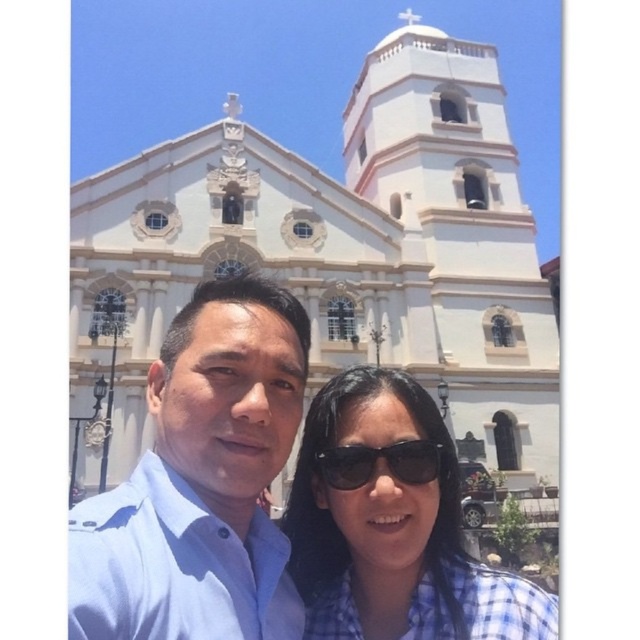
Is white stone church at center thinner than blue shirt at center?

Incorrect, white stone church at center's width is not less than blue shirt at center's.

Can you confirm if white stone church at center is shorter than blue shirt at center?

No.

The image size is (640, 640). In order to click on white stone church at center in this screenshot , I will do `click(342, 253)`.

Identify the location of white stone church at center. (342, 253).

Image resolution: width=640 pixels, height=640 pixels. What do you see at coordinates (200, 483) in the screenshot? I see `blue shirt at center` at bounding box center [200, 483].

Does blue shirt at center have a larger size compared to blue checkered shirt at center?

Yes.

Which is in front, point (250, 285) or point (422, 486)?

Positioned in front is point (422, 486).

What are the coordinates of `blue shirt at center` in the screenshot? It's located at (200, 483).

Who is higher up, blue shirt at center or black matte sunglasses at center?

blue shirt at center is higher up.

Does blue shirt at center have a smaller size compared to black matte sunglasses at center?

No.

What do you see at coordinates (200, 483) in the screenshot?
I see `blue shirt at center` at bounding box center [200, 483].

At what (x,y) coordinates should I click in order to perform the action: click on blue shirt at center. Please return your answer as a coordinate pair (x, y). The height and width of the screenshot is (640, 640). Looking at the image, I should click on (200, 483).